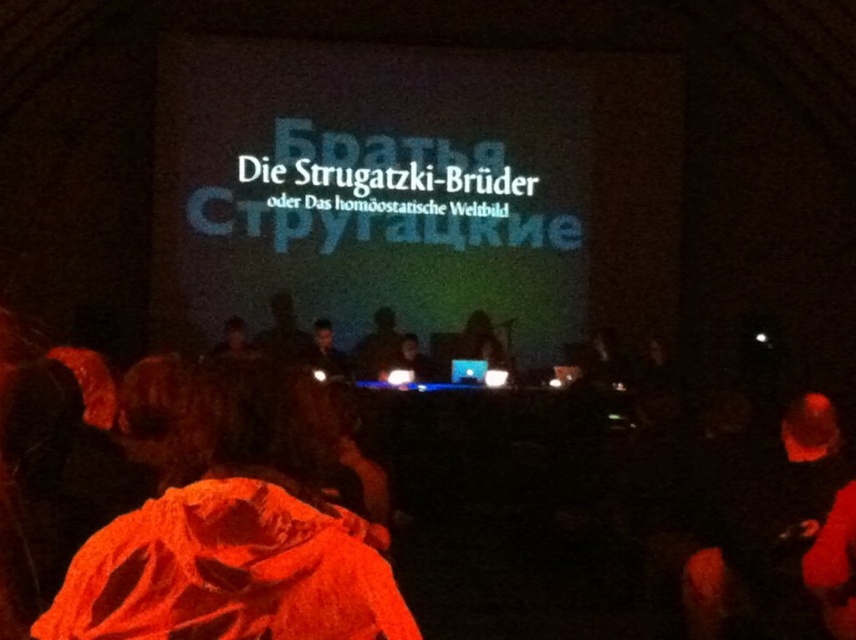
Question: Is smooth black laptop at center wider than matte white screen at center?

Choices:
 (A) yes
 (B) no

Answer: (A)

Question: Which point appears farthest from the camera in this image?

Choices:
 (A) (476, 365)
 (B) (399, 362)

Answer: (A)

Question: Can you confirm if smooth black laptop at center is bigger than matte white screen at center?

Choices:
 (A) no
 (B) yes

Answer: (B)

Question: Which point appears closest to the camera in this image?

Choices:
 (A) (458, 380)
 (B) (409, 339)

Answer: (A)

Question: Does smooth black laptop at center appear on the left side of matte white screen at center?

Choices:
 (A) yes
 (B) no

Answer: (A)